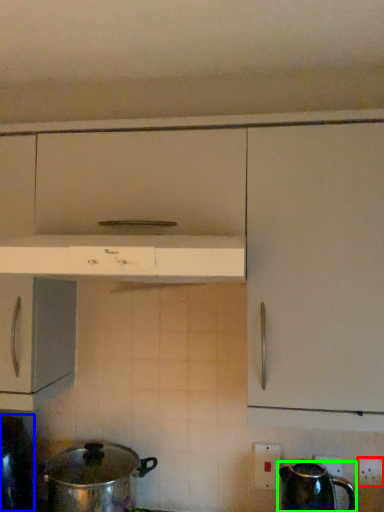
Question: Which is farther away from electric outlet (highlighted by a red box)? kitchen appliance (highlighted by a blue box) or kettle (highlighted by a green box)?

Choices:
 (A) kitchen appliance
 (B) kettle

Answer: (A)